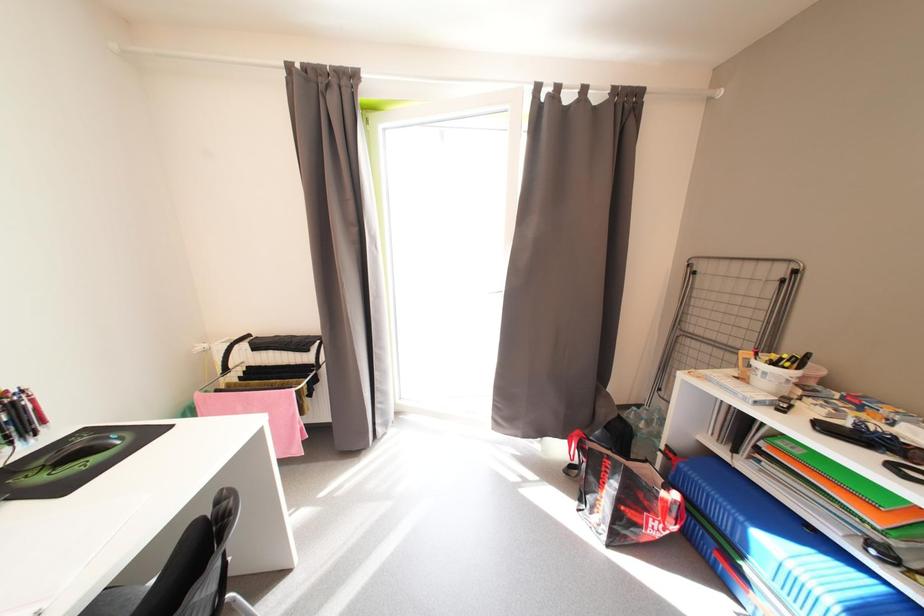
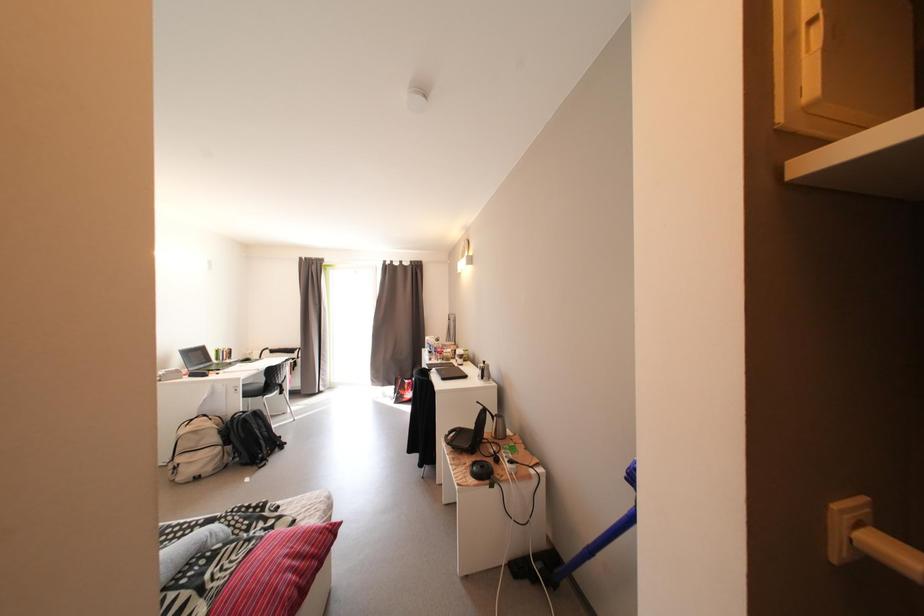
Which direction would the cameraman need to move to produce the second image?

The movement direction of the cameraman is right, backward.